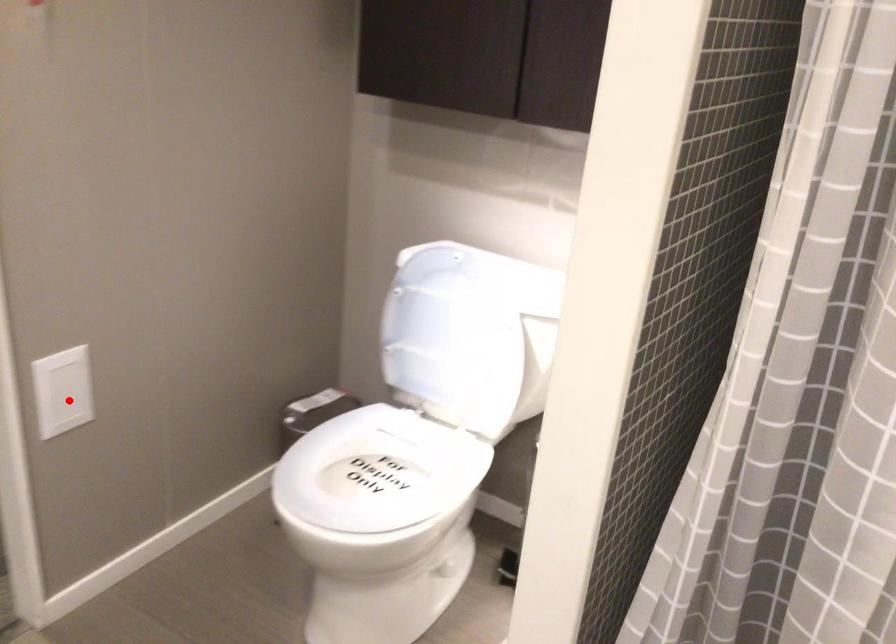
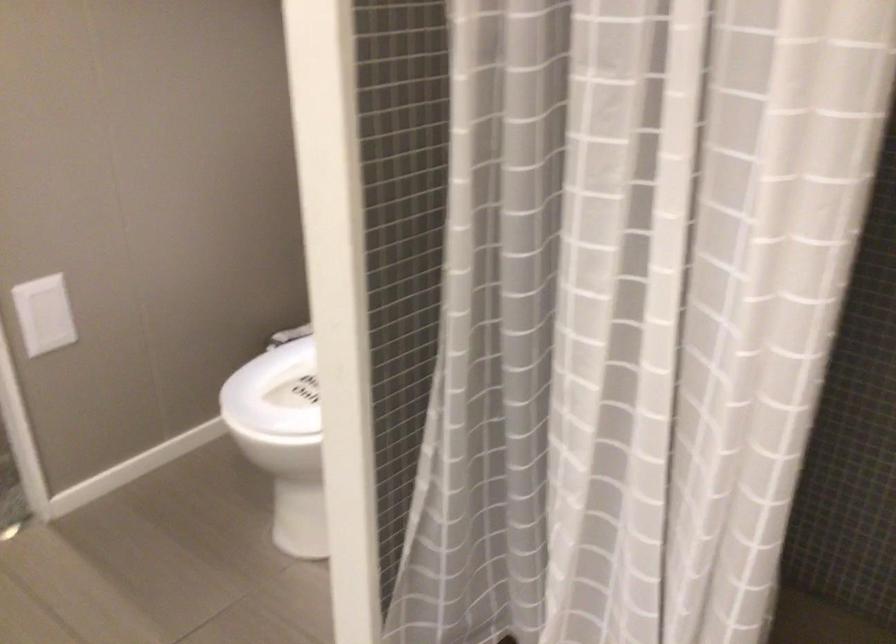
In the second image, find the point that corresponds to the highlighted location in the first image.

(53, 323)